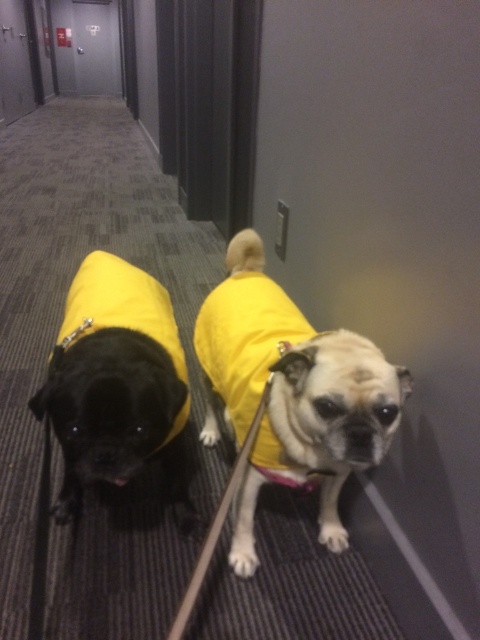
Question: Among these objects, which one is nearest to the camera?

Choices:
 (A) shiny black pug at left
 (B) yellow fabric dog at center

Answer: (B)

Question: From the image, what is the correct spatial relationship of yellow fabric dog at center in relation to shiny black pug at left?

Choices:
 (A) below
 (B) above

Answer: (B)

Question: Which object appears farthest from the camera in this image?

Choices:
 (A) shiny black pug at left
 (B) yellow fabric dog at center

Answer: (A)

Question: Which point appears farthest from the camera in this image?

Choices:
 (A) (96, 468)
 (B) (216, 349)

Answer: (B)

Question: Is yellow fabric dog at center bigger than shiny black pug at left?

Choices:
 (A) yes
 (B) no

Answer: (A)

Question: Can you confirm if yellow fabric dog at center is bigger than shiny black pug at left?

Choices:
 (A) no
 (B) yes

Answer: (B)